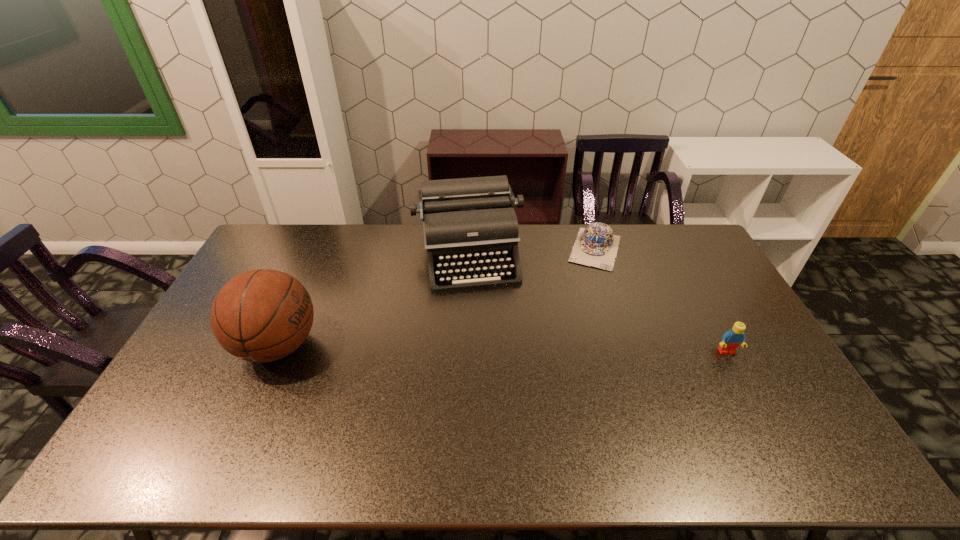
Locate an element on the screen. free space on the desktop that is between the basketball and the rightmost object and is positioned on the typing side of the typewriter is located at coordinates (485, 348).

Identify the location of free space on the desktop that is between the leftmost object and the Lego and is positioned on the front, side, and top of the shortest object. The image size is (960, 540). point(565,349).